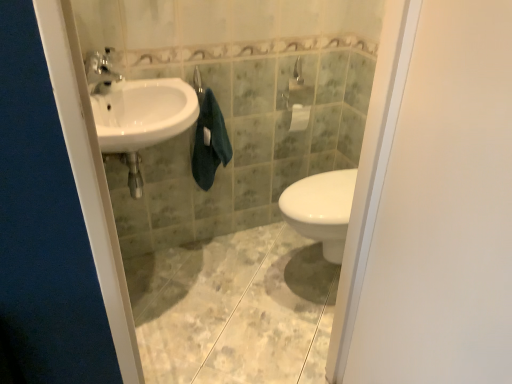
Question: Can you confirm if white glossy sink at left is smaller than dark green towel at center?

Choices:
 (A) yes
 (B) no

Answer: (B)

Question: Is white glossy sink at left directly adjacent to dark green towel at center?

Choices:
 (A) no
 (B) yes

Answer: (A)

Question: Is dark green towel at center at the back of white glossy sink at left?

Choices:
 (A) yes
 (B) no

Answer: (B)

Question: Could you tell me if white glossy sink at left is turned towards dark green towel at center?

Choices:
 (A) no
 (B) yes

Answer: (A)

Question: Is the position of white glossy sink at left less distant than that of dark green towel at center?

Choices:
 (A) yes
 (B) no

Answer: (A)

Question: From a real-world perspective, is dark green towel at center physically located above or below white glossy sink at left?

Choices:
 (A) below
 (B) above

Answer: (A)

Question: From the image's perspective, is dark green towel at center above or below white glossy sink at left?

Choices:
 (A) below
 (B) above

Answer: (A)

Question: Is dark green towel at center wider or thinner than white glossy sink at left?

Choices:
 (A) thin
 (B) wide

Answer: (A)

Question: In the image, is dark green towel at center positioned in front of or behind white glossy sink at left?

Choices:
 (A) behind
 (B) front

Answer: (A)

Question: In terms of size, does matte silver faucet at upper left appear bigger or smaller than dark green towel at center?

Choices:
 (A) small
 (B) big

Answer: (A)

Question: Would you say matte silver faucet at upper left is inside or outside dark green towel at center?

Choices:
 (A) inside
 (B) outside

Answer: (B)

Question: From a real-world perspective, is matte silver faucet at upper left positioned above or below dark green towel at center?

Choices:
 (A) below
 (B) above

Answer: (B)

Question: Is matte silver faucet at upper left taller or shorter than dark green towel at center?

Choices:
 (A) tall
 (B) short

Answer: (B)

Question: Is matte silver faucet at upper left in front of or behind white matte screen door at right in the image?

Choices:
 (A) behind
 (B) front

Answer: (A)

Question: In terms of height, does matte silver faucet at upper left look taller or shorter compared to white matte screen door at right?

Choices:
 (A) short
 (B) tall

Answer: (A)